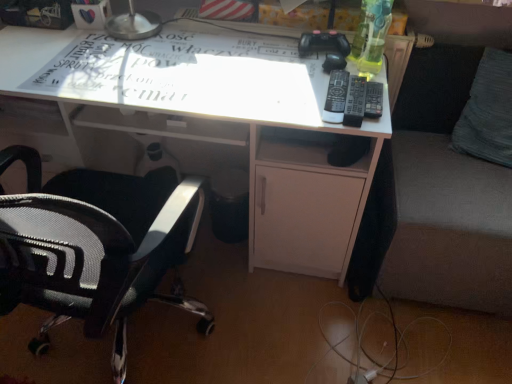
The image size is (512, 384). I want to click on vacant space positioned to the left of white matte wire at lower center, so click(x=236, y=316).